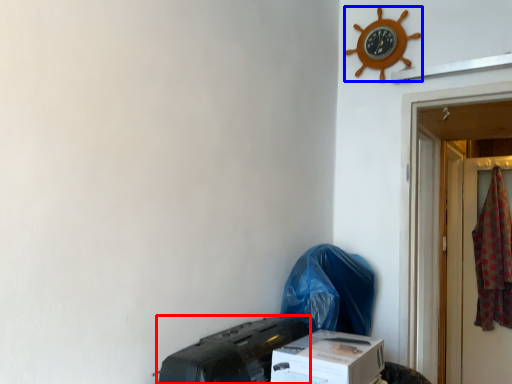
Question: Which object is further to the camera taking this photo, printer (highlighted by a red box) or clock (highlighted by a blue box)?

Choices:
 (A) printer
 (B) clock

Answer: (B)